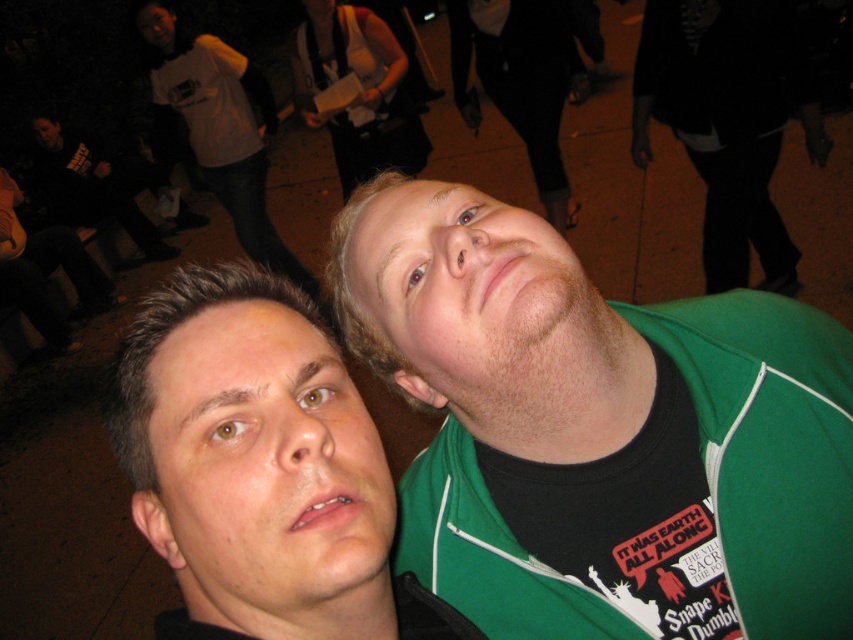
Looking at this image, you are taking a photo of two people standing near each other. The person on the left is wearing a black shirt, and the person on the right has a green jacket over a black shirt. There is a point at coordinates point (599, 432). Can you determine which clothing item is located at that point?

The green fabric shirt at upper right is represented by point (599, 432).

You are a photographer trying to capture a clear shot of both the matte black face at center and the white cotton shirt at upper left. Which object will appear larger in your photo?

The matte black face at center will appear larger in the photo because it is closer to the viewer than the white cotton shirt at upper left.